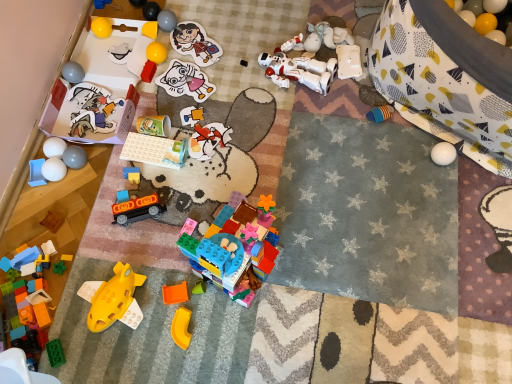
The width and height of the screenshot is (512, 384). I want to click on vacant space that's between translucent orange plastic toy at center, the fourth toy in the right-to-left sequence, and matte gray ball at upper center, which is the 18th toy in left-to-right order, so [178, 124].